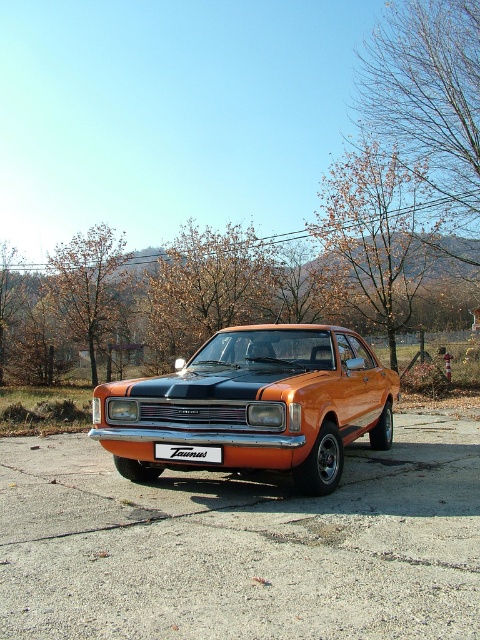
Which is behind, point (207, 387) or point (212, 458)?

Point (207, 387)

Who is shorter, orange metallic car at center or white plastic sign at center?

With less height is white plastic sign at center.

At what (x,y) coordinates should I click in order to perform the action: click on orange metallic car at center. Please return your answer as a coordinate pair (x, y). Looking at the image, I should click on (254, 404).

I want to click on orange metallic car at center, so click(x=254, y=404).